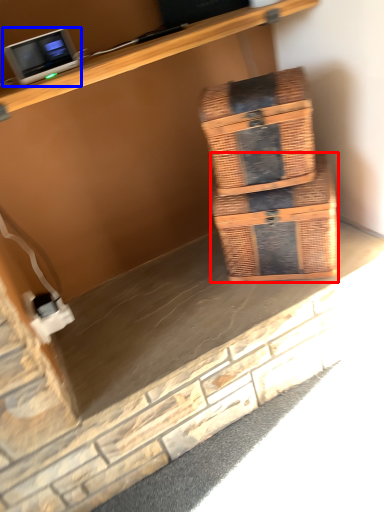
Question: Which object is closer to the camera taking this photo, box (highlighted by a red box) or desktop computer (highlighted by a blue box)?

Choices:
 (A) box
 (B) desktop computer

Answer: (B)